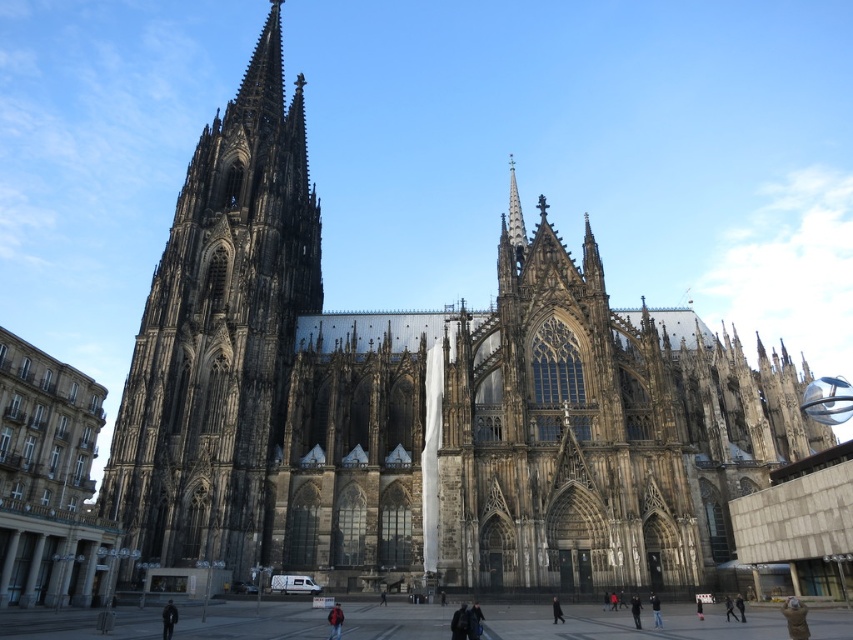
Does dark gray fabric jacket at lower left appear on the left side of black fabric person at center?

Correct, you'll find dark gray fabric jacket at lower left to the left of black fabric person at center.

From the picture: Does dark gray fabric jacket at lower left appear on the right side of black fabric person at center?

No, dark gray fabric jacket at lower left is not to the right of black fabric person at center.

Which is in front, point (165, 630) or point (552, 602)?

Positioned in front is point (165, 630).

Where is `dark gray fabric jacket at lower left`? This screenshot has width=853, height=640. dark gray fabric jacket at lower left is located at coordinates (167, 620).

From the picture: Does dark stone tower at left have a larger size compared to red jacket at center?

Indeed, dark stone tower at left has a larger size compared to red jacket at center.

Between point (215, 314) and point (341, 612), which one is positioned in front?

Point (341, 612)

The height and width of the screenshot is (640, 853). Find the location of `dark stone tower at left`. dark stone tower at left is located at coordinates pyautogui.click(x=219, y=336).

Which is above, dark stone tower at left or black fabric person at center?

Positioned higher is dark stone tower at left.

Is point (154, 314) closer to viewer compared to point (560, 616)?

No, it is not.

This screenshot has width=853, height=640. Find the location of `dark stone tower at left`. dark stone tower at left is located at coordinates (219, 336).